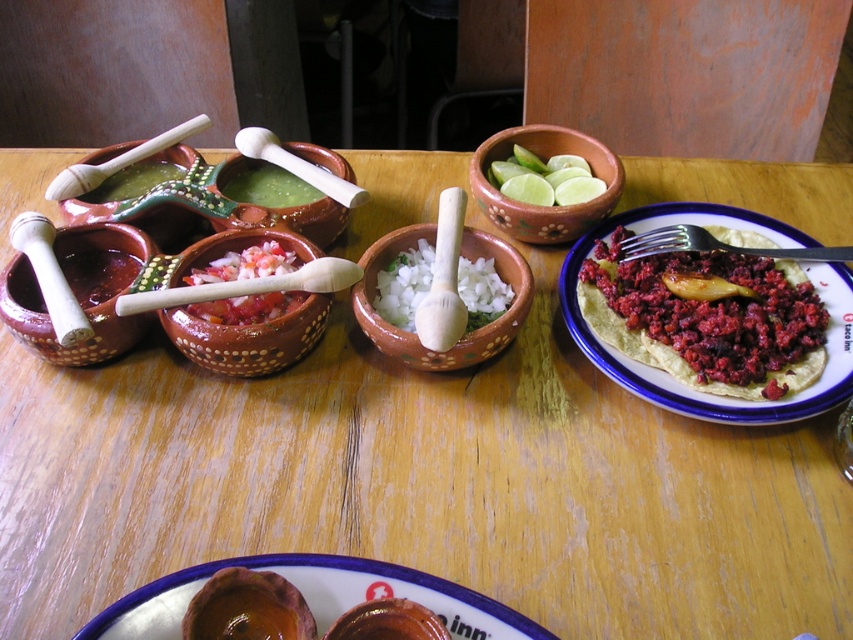
You are a chef preparing a dish and need to move the wooden pestle at center to the right side of the table. The table is 30 inches wide. Can you move the pestle without it hanging off the edge?

The wooden pestle at center is 25.69 inches away from the right side of the table. Since the table is 30 inches wide, moving the pestle 25.69 inches to the right would leave 4.31 inches between the pestle and the edge, so yes, it can be moved without hanging off.

You are a chef preparing a dish and need to place the matte red tortilla at right onto a plate that is 12 inches away from your current position. Can you reach the tortilla without moving your feet?

The matte red tortilla at right is 24.69 inches away from the viewer. Since the plate is only 12 inches away, the tortilla is further than the plate, so you cannot reach it without moving your feet.

You are a chef preparing a dish that requires moving ingredients between the wooden pestle at center and the white wood pestle at upper left. If your hand can cover a distance of 10 inches, will you be able to reach from one to the other without moving your arm?

The wooden pestle at center and white wood pestle at upper left are 10.20 inches apart. Since your hand can cover 10 inches, you cannot reach from one to the other without moving your arm because the distance is slightly longer than your hand can cover.